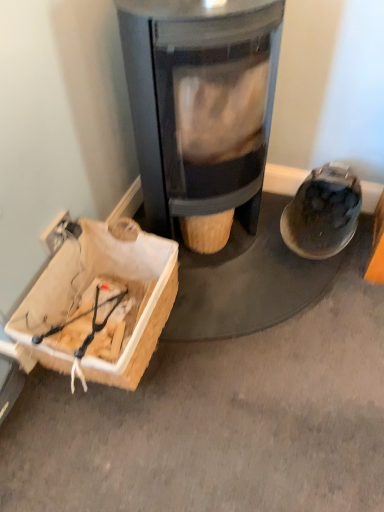
I want to click on vacant space that is in between matte black shoe at right and wooden crate at lower left, so click(242, 294).